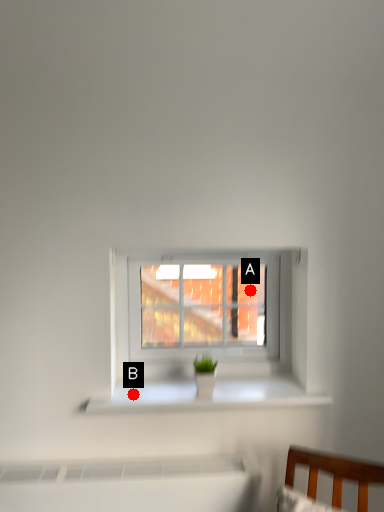
Question: Two points are circled on the image, labeled by A and B beside each circle. Which point appears closest to the camera in this image?

Choices:
 (A) A is closer
 (B) B is closer

Answer: (B)